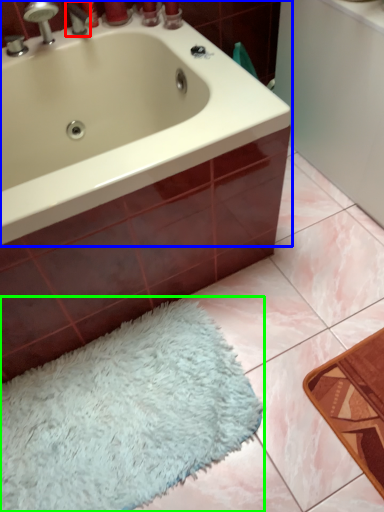
Question: Which object is the farthest from tap (highlighted by a red box)? Choose among these: bathtub (highlighted by a blue box) or bath mat (highlighted by a green box).

Choices:
 (A) bathtub
 (B) bath mat

Answer: (B)